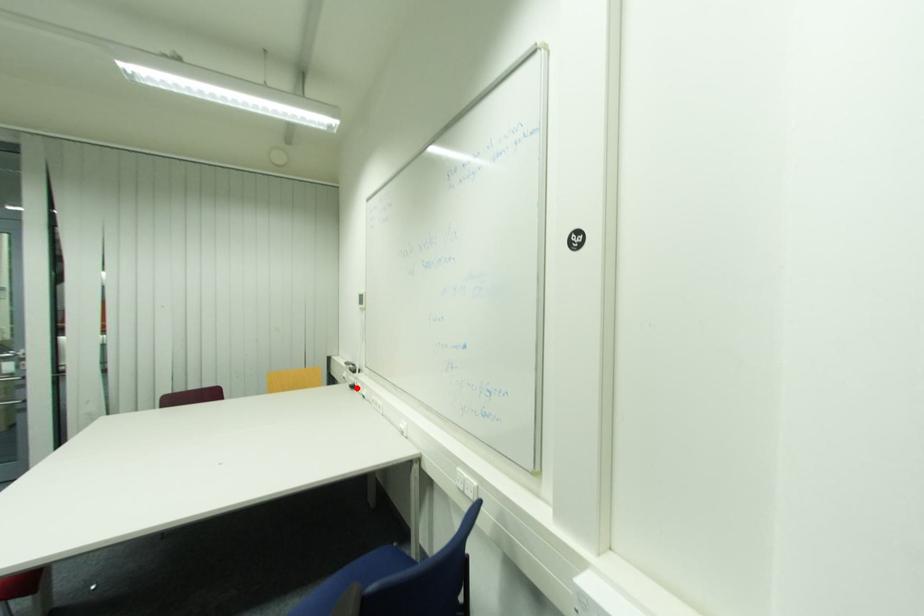
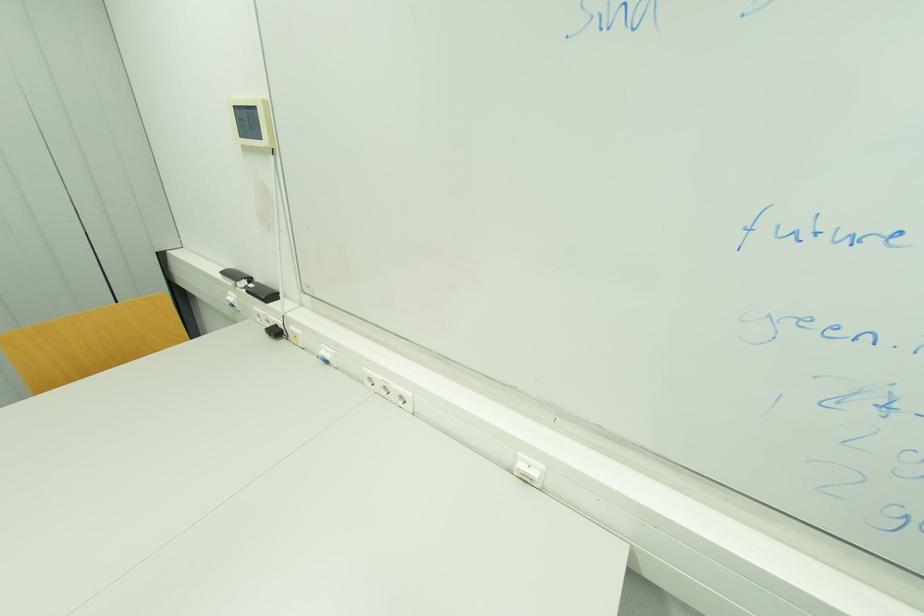
In the second image, find the point that corresponds to the highlighted location in the first image.

(281, 333)